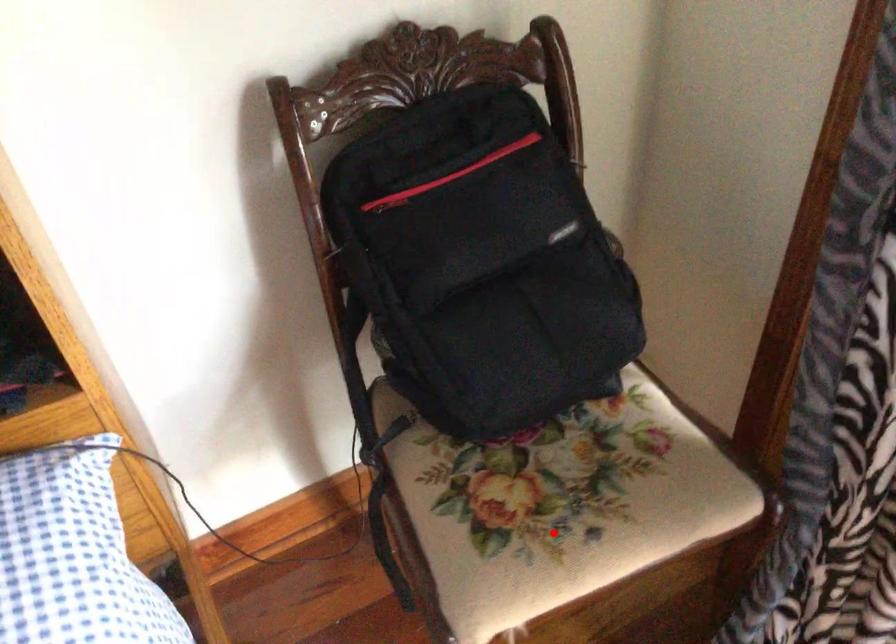
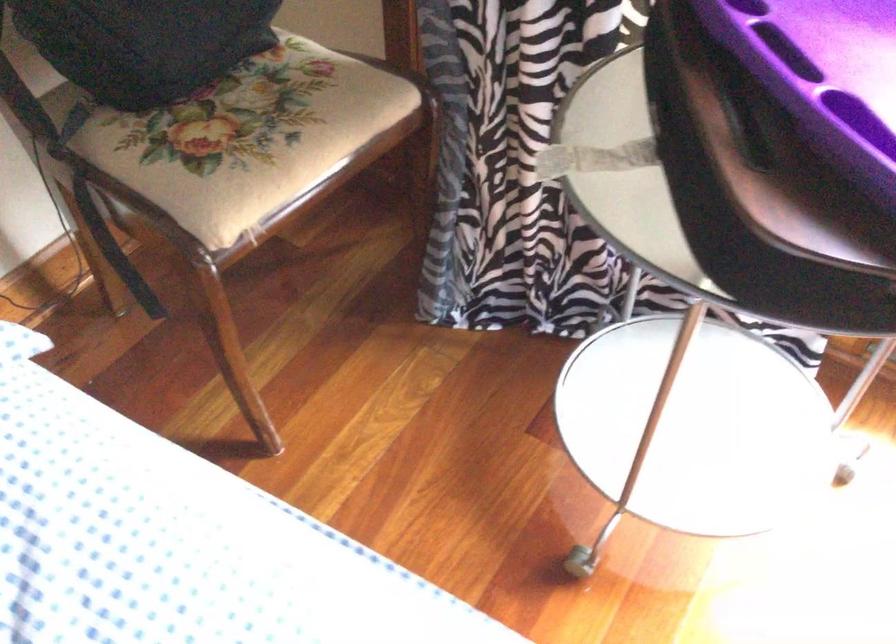
Question: A red point is marked in image1. In image2, is the corresponding 3D point closer to the camera or farther? Reply with the corresponding letter.

Choices:
 (A) The corresponding 3D point is closer.
 (B) The corresponding 3D point is farther.

Answer: (B)